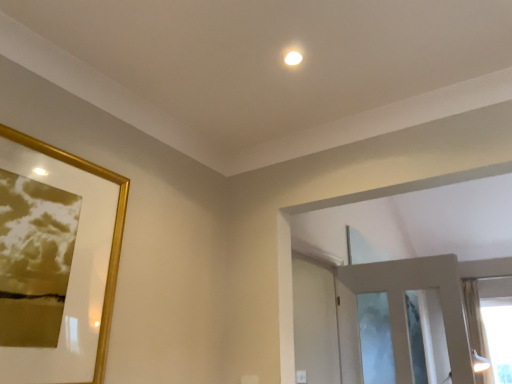
Question: From a real-world perspective, is gold glossy picture frame at upper left positioned above or below sheer fabric curtain at right?

Choices:
 (A) above
 (B) below

Answer: (B)

Question: Is gold glossy picture frame at upper left wider or thinner than sheer fabric curtain at right?

Choices:
 (A) thin
 (B) wide

Answer: (A)

Question: Which object is positioned farthest from the gold glossy picture frame at upper left?

Choices:
 (A) sheer fabric curtain at right
 (B) white glossy screen door at center

Answer: (A)

Question: Which object is the farthest from the gold glossy picture frame at upper left?

Choices:
 (A) white glossy screen door at center
 (B) sheer fabric curtain at right

Answer: (B)